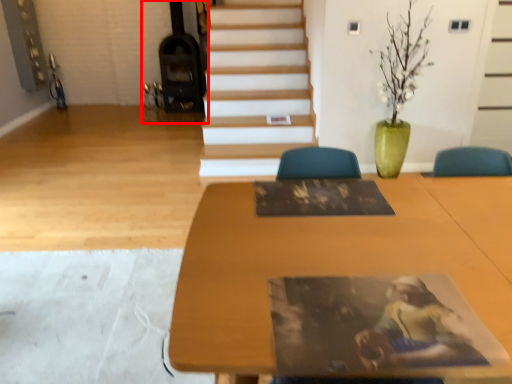
Question: From the image's perspective, what is the correct spatial relationship of fireplace (annotated by the red box) in relation to table?

Choices:
 (A) above
 (B) below

Answer: (A)